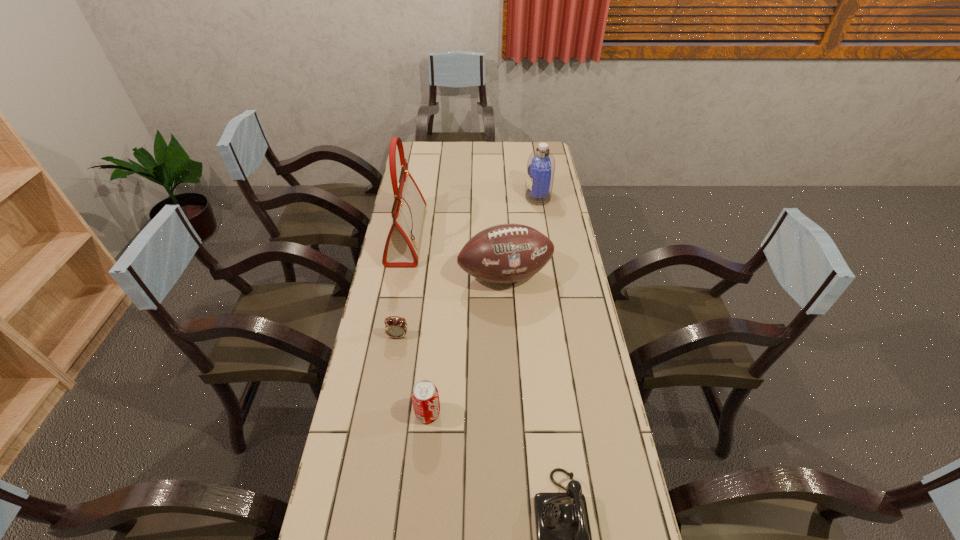
Where is `empty location between the alarm clock and the handbag`? Image resolution: width=960 pixels, height=540 pixels. empty location between the alarm clock and the handbag is located at coordinates (402, 286).

Where is `free area in between the tallest object and the alarm clock`? Image resolution: width=960 pixels, height=540 pixels. free area in between the tallest object and the alarm clock is located at coordinates (402, 286).

Identify the location of free space between the handbag and the alarm clock. (x=402, y=286).

Choose which object is the fifth nearest neighbor to the fourth farthest object. Please provide its 2D coordinates. Your answer should be formatted as a tuple, i.e. [(x, y)], where the tuple contains the x and y coordinates of a point satisfying the conditions above.

[(541, 163)]

Choose which object is the nearest neighbor to the fourth object from right to left. Please provide its 2D coordinates. Your answer should be formatted as a tuple, i.e. [(x, y)], where the tuple contains the x and y coordinates of a point satisfying the conditions above.

[(394, 327)]

Locate an element on the screen. Image resolution: width=960 pixels, height=540 pixels. free location that satisfies the following two spatial constraints: 1. on the front side of the fifth farthest object; 2. on the right side of the handbag is located at coordinates (374, 414).

Locate an element on the screen. The image size is (960, 540). free point that satisfies the following two spatial constraints: 1. on the back side of the fourth tallest object; 2. on the right side of the farthest object is located at coordinates (447, 196).